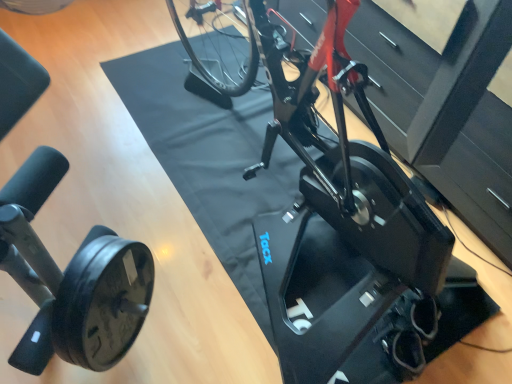
Find the location of `empty space that is ontop of black matte stationary bicycle at center, which is the first stationary bicycle in back-to-front order (from a real-world perspective)`. empty space that is ontop of black matte stationary bicycle at center, which is the first stationary bicycle in back-to-front order (from a real-world perspective) is located at coordinates (237, 166).